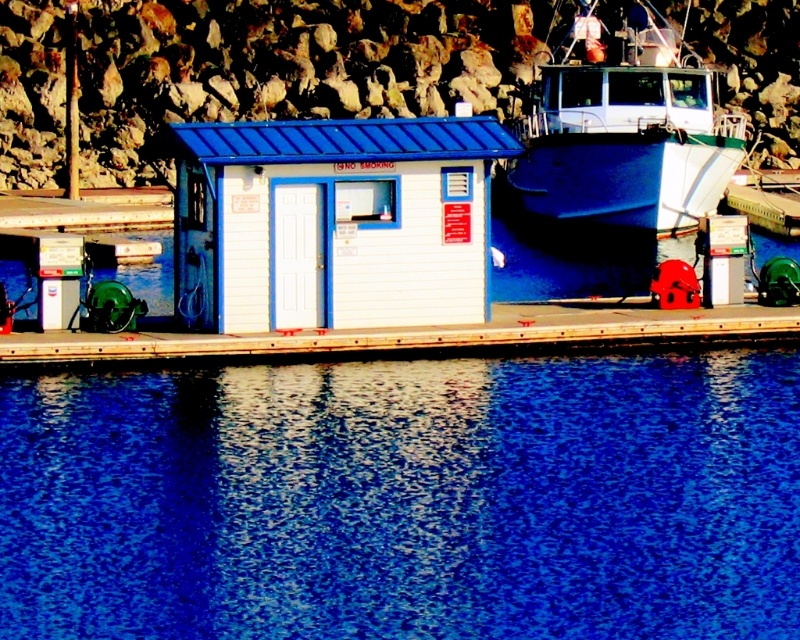
Question: Which object is the farthest from the white matte hut at center?

Choices:
 (A) blue liquid water at lower center
 (B) blue glossy boat at right

Answer: (B)

Question: Does blue liquid water at lower center appear under blue glossy boat at right?

Choices:
 (A) no
 (B) yes

Answer: (B)

Question: Which object appears farthest from the camera in this image?

Choices:
 (A) blue glossy boat at right
 (B) blue liquid water at lower center
 (C) white matte hut at center

Answer: (C)

Question: Which point appears farthest from the camera in this image?

Choices:
 (A) (570, 108)
 (B) (224, 131)

Answer: (A)

Question: In this image, where is white matte hut at center located relative to blue glossy boat at right?

Choices:
 (A) above
 (B) below

Answer: (B)

Question: Can you confirm if blue liquid water at lower center is positioned below white matte hut at center?

Choices:
 (A) no
 (B) yes

Answer: (B)